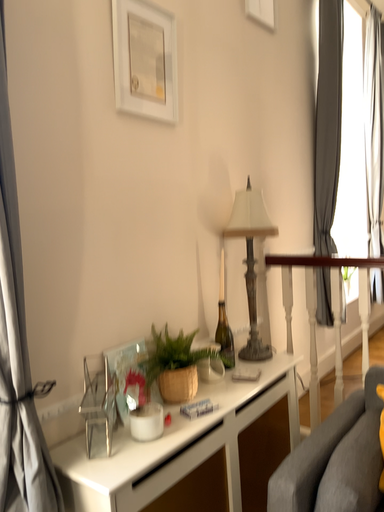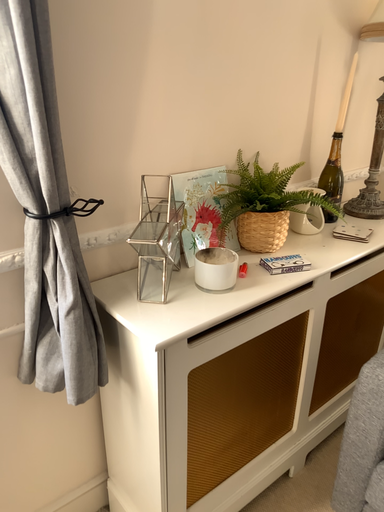
Question: How did the camera likely rotate when shooting the video?

Choices:
 (A) rotated left
 (B) rotated right

Answer: (A)